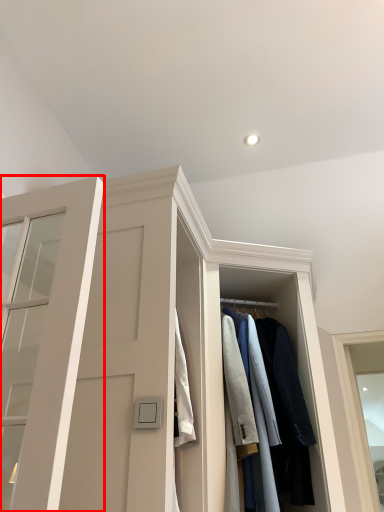
Question: Where is door (annotated by the red box) located in relation to clothing in the image?

Choices:
 (A) left
 (B) right

Answer: (A)